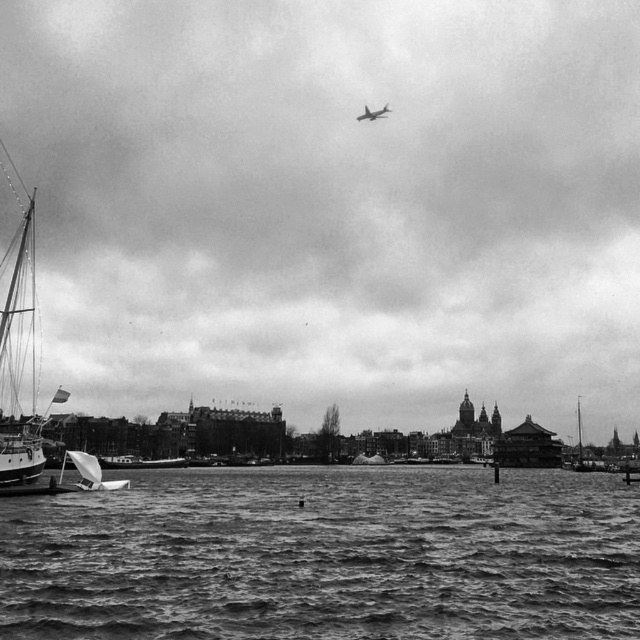
Question: Does white plastic sailboat at lower left have a larger size compared to metallic silver airplane at upper center?

Choices:
 (A) no
 (B) yes

Answer: (B)

Question: Which point appears farthest from the camera in this image?

Choices:
 (A) (630, 627)
 (B) (84, 484)
 (C) (172, 461)
 (D) (579, 396)

Answer: (D)

Question: In this image, where is rough textured water at lower center located relative to white plastic sailboat at lower left?

Choices:
 (A) left
 (B) right

Answer: (B)

Question: Where is rough textured water at lower center located in relation to white matte sailboat at right in the image?

Choices:
 (A) left
 (B) right

Answer: (A)

Question: Which point is closer to the camera taking this photo?

Choices:
 (A) (388, 109)
 (B) (77, 460)
 (C) (580, 426)
 (D) (250, 538)

Answer: (D)

Question: Estimate the real-world distances between objects in this image. Which object is farther from the metallic silver airplane at upper center?

Choices:
 (A) white plastic sailboat at lower left
 (B) smooth white boat at lower left
 (C) white matte sailboat at right

Answer: (A)